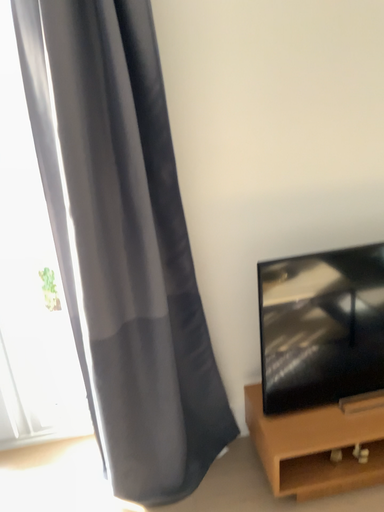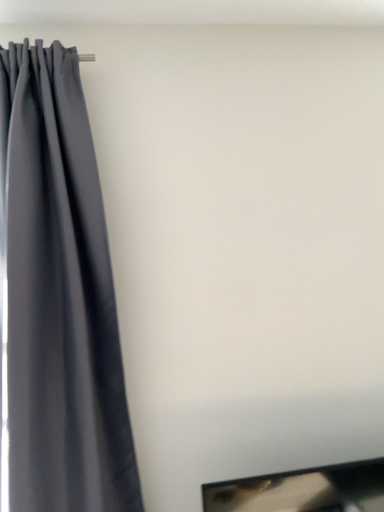
Question: Which way did the camera rotate in the video?

Choices:
 (A) rotated downward
 (B) rotated upward

Answer: (B)